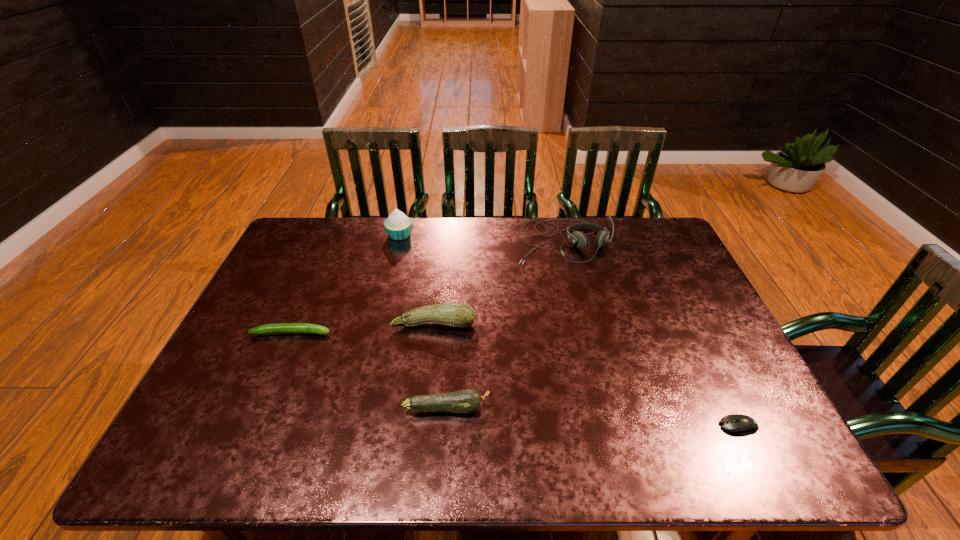
I want to click on free space located 0.310m on the front of the tallest object, so tap(382, 307).

Locate an element on the screen. The height and width of the screenshot is (540, 960). vacant space located on the outer surface of the second object from right to left is located at coordinates (572, 278).

Locate an element on the screen. The image size is (960, 540). vacant space located at the stem end of the third tallest object is located at coordinates (424, 418).

Image resolution: width=960 pixels, height=540 pixels. Find the location of `vacant area situated at the blossom end of the nearest zucchini`. vacant area situated at the blossom end of the nearest zucchini is located at coordinates (649, 408).

Locate an element on the screen. This screenshot has height=540, width=960. blank space located 0.220m on the front-facing side of the fifth tallest object is located at coordinates (413, 333).

This screenshot has width=960, height=540. Find the location of `free location located 0.080m on the wheel side of the computer mouse`. free location located 0.080m on the wheel side of the computer mouse is located at coordinates (684, 426).

What are the coordinates of `free point located 0.060m on the wheel side of the computer mouse` in the screenshot? It's located at (693, 426).

I want to click on vacant region located on the wheel side of the computer mouse, so tap(698, 426).

Where is `cupcake present at the far edge`? Image resolution: width=960 pixels, height=540 pixels. cupcake present at the far edge is located at coordinates (398, 226).

You are a GUI agent. You are given a task and a screenshot of the screen. Output one action in this format:
    pyautogui.click(x=<x>, y=<y>)
    Task: Click on the headset that is at the far edge
    The image size is (960, 540).
    Given the screenshot: What is the action you would take?
    pyautogui.click(x=579, y=239)